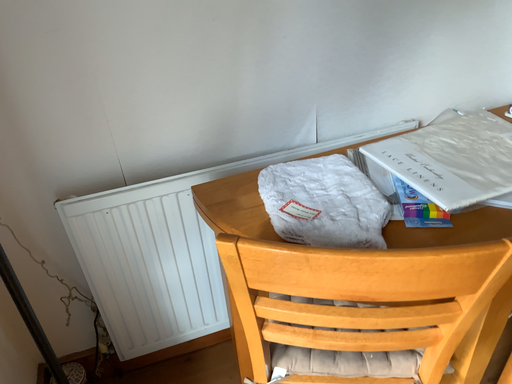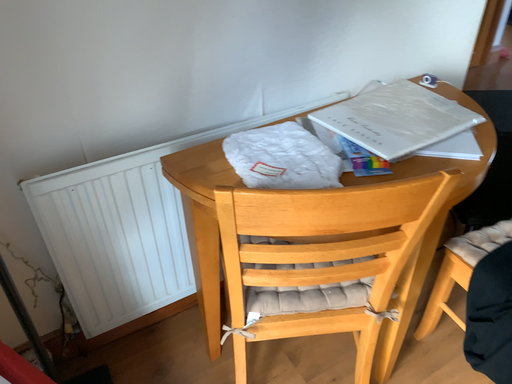
Question: How did the camera likely rotate when shooting the video?

Choices:
 (A) rotated left
 (B) rotated right

Answer: (B)